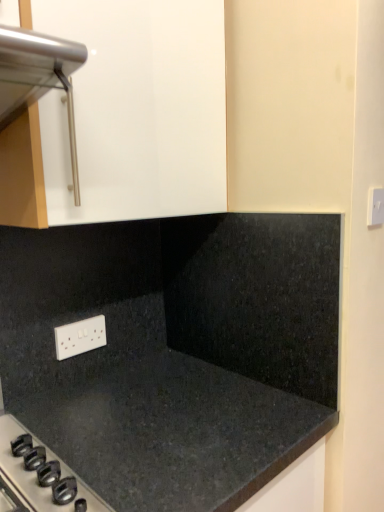
Question: From the image's perspective, is black granite countertop at lower left under white plastic electric outlet at upper right, placed as the second electric outlet when sorted from bottom to top?

Choices:
 (A) yes
 (B) no

Answer: (A)

Question: Considering the relative sizes of black granite countertop at lower left and white plastic electric outlet at upper right, placed as the second electric outlet when sorted from bottom to top, in the image provided, is black granite countertop at lower left smaller than white plastic electric outlet at upper right, placed as the second electric outlet when sorted from bottom to top,?

Choices:
 (A) yes
 (B) no

Answer: (B)

Question: Could you tell me if black granite countertop at lower left is turned towards white plastic electric outlet at upper right, placed as the second electric outlet when sorted from bottom to top?

Choices:
 (A) yes
 (B) no

Answer: (B)

Question: From a real-world perspective, is black granite countertop at lower left positioned over white plastic electric outlet at upper right, which is the first electric outlet in right-to-left order, based on gravity?

Choices:
 (A) no
 (B) yes

Answer: (A)

Question: Does black granite countertop at lower left come behind white plastic electric outlet at upper right, which is the first electric outlet in right-to-left order?

Choices:
 (A) yes
 (B) no

Answer: (B)

Question: From a real-world perspective, is white plastic electric outlet at upper right, which is the first electric outlet in right-to-left order, physically located above or below black granite countertop at lower left?

Choices:
 (A) below
 (B) above

Answer: (B)

Question: From the image's perspective, relative to black granite countertop at lower left, is white plastic electric outlet at upper right, which is the second electric outlet in left-to-right order, above or below?

Choices:
 (A) below
 (B) above

Answer: (B)

Question: Considering the positions of white plastic electric outlet at upper right, the 1th electric outlet in the top-to-bottom sequence, and black granite countertop at lower left in the image, is white plastic electric outlet at upper right, the 1th electric outlet in the top-to-bottom sequence, bigger or smaller than black granite countertop at lower left?

Choices:
 (A) big
 (B) small

Answer: (B)

Question: Considering the positions of point (375, 202) and point (162, 266), is point (375, 202) closer or farther from the camera than point (162, 266)?

Choices:
 (A) farther
 (B) closer

Answer: (B)

Question: Is point (102, 329) closer or farther from the camera than point (367, 205)?

Choices:
 (A) farther
 (B) closer

Answer: (A)

Question: From the image's perspective, is white plastic electric outlet at lower left, which is counted as the 1th electric outlet, starting from the back, located above or below white plastic electric outlet at upper right, which is the second electric outlet in left-to-right order?

Choices:
 (A) below
 (B) above

Answer: (A)

Question: In terms of width, does white plastic electric outlet at lower left, positioned as the 1th electric outlet in left-to-right order, look wider or thinner when compared to white plastic electric outlet at upper right, placed as the second electric outlet when sorted from bottom to top?

Choices:
 (A) thin
 (B) wide

Answer: (A)

Question: Considering their positions, is white plastic electric outlet at lower left, positioned as the second electric outlet in right-to-left order, located in front of or behind white plastic electric outlet at upper right, placed as the first electric outlet when sorted from front to back?

Choices:
 (A) front
 (B) behind

Answer: (B)

Question: Relative to white plastic electric outlet at upper right, which is the second electric outlet in left-to-right order, is black granite countertop at lower left in front or behind?

Choices:
 (A) front
 (B) behind

Answer: (A)

Question: Considering the positions of black granite countertop at lower left and white plastic electric outlet at upper right, the 1th electric outlet in the top-to-bottom sequence, in the image, is black granite countertop at lower left taller or shorter than white plastic electric outlet at upper right, the 1th electric outlet in the top-to-bottom sequence,?

Choices:
 (A) short
 (B) tall

Answer: (B)